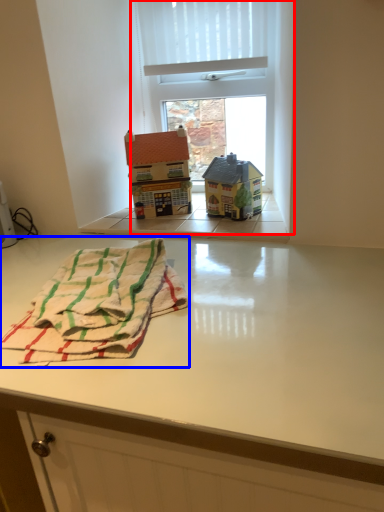
Question: Which object appears farthest to the camera in this image, window (highlighted by a red box) or beach towel (highlighted by a blue box)?

Choices:
 (A) window
 (B) beach towel

Answer: (A)